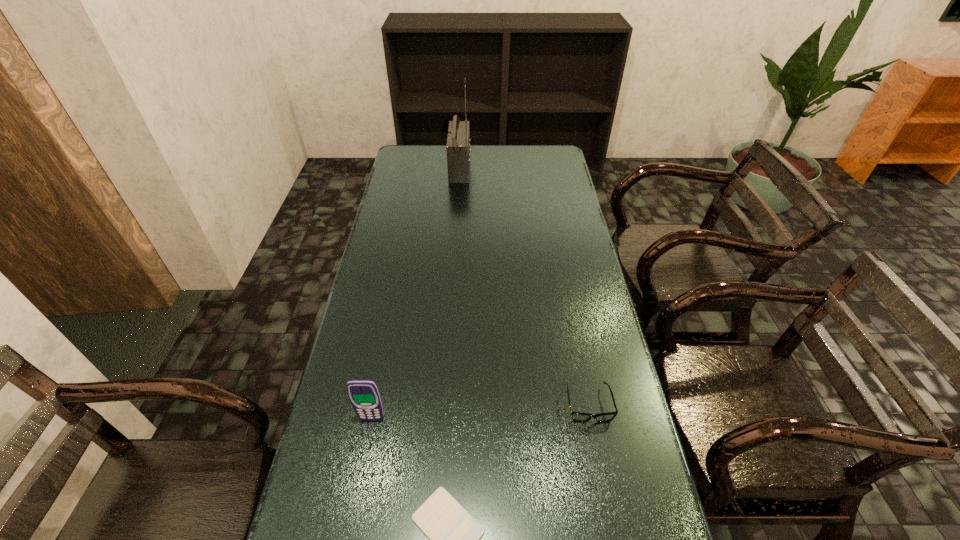
The image size is (960, 540). I want to click on the tallest object, so click(458, 140).

Image resolution: width=960 pixels, height=540 pixels. Find the location of `the farthest object`. the farthest object is located at coordinates (458, 140).

Where is `the leftmost object`? the leftmost object is located at coordinates (364, 394).

Locate an element on the screen. the third shortest object is located at coordinates [364, 394].

The image size is (960, 540). In order to click on the third tallest object in this screenshot , I will do `click(579, 417)`.

Locate an element on the screen. The image size is (960, 540). sunglasses is located at coordinates (579, 417).

At what (x,y) coordinates should I click in order to perform the action: click on free space located 0.300m on the front panel of the tallest object. Please return your answer as a coordinate pair (x, y). The image size is (960, 540). Looking at the image, I should click on (538, 168).

Find the location of a particular element. The width and height of the screenshot is (960, 540). vacant space located 0.120m on the front-facing side of the leftmost object is located at coordinates (362, 470).

Find the location of a particular element. free space located on the front-facing side of the rightmost object is located at coordinates (601, 469).

At what (x,y) coordinates should I click in order to perform the action: click on object present at the far edge. Please return your answer as a coordinate pair (x, y). Looking at the image, I should click on (458, 140).